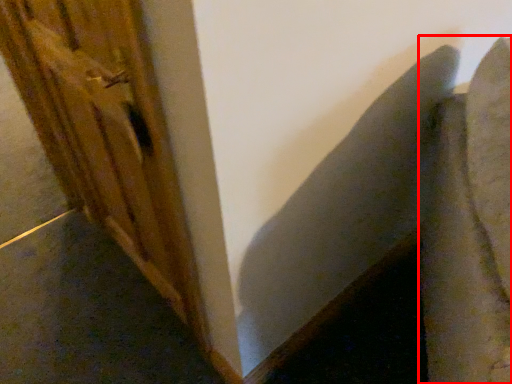
Question: From the image, what is the correct spatial relationship of swivel chair (annotated by the red box) in relation to barn door?

Choices:
 (A) right
 (B) left

Answer: (A)